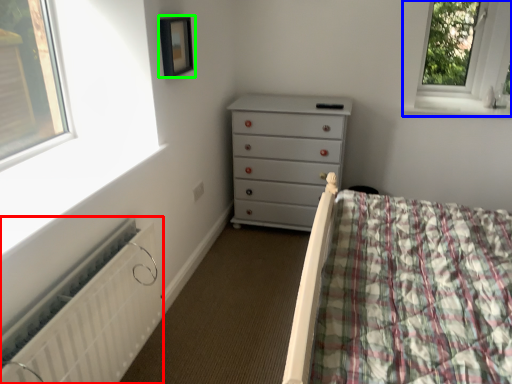
Question: Based on their relative distances, which object is nearer to radiator (highlighted by a red box)? Choose from window (highlighted by a blue box) and picture frame (highlighted by a green box).

Choices:
 (A) window
 (B) picture frame

Answer: (B)